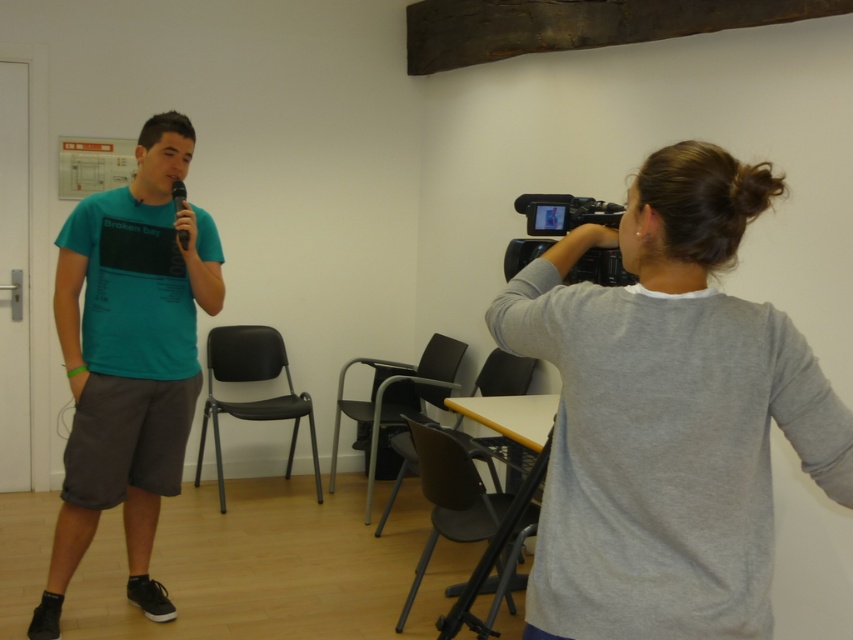
You are an assistant in the recording studio. You need to adjust the microphone so that it is positioned to the right of the gray matte shirt. Is the black matte microphone at left currently positioned to the right of the gray matte shirt at upper right?

The gray matte shirt at upper right is to the right of the black matte microphone at left, so the black matte microphone at left is not positioned to the right of the gray matte shirt at upper right. You need to move it to the right side of the gray matte shirt at upper right.

You are setting up a camera to film the scene. The camera is mounted on the black plastic tripod at lower center. To ensure the gray matte shirt at upper right is fully visible in the frame, should you adjust the camera angle upwards or downwards?

The gray matte shirt at upper right is above the black plastic tripod at lower center, so you should adjust the camera angle upwards to capture the gray matte shirt at upper right in the frame.

You are a photographer positioned in the room and want to capture a clear shot of both the gray matte shirt at upper right and the black plastic tripod at lower center. Which object should you focus on first to ensure both are in focus?

You should focus on the gray matte shirt at upper right first because it is closer to the viewer than the black plastic tripod at lower center. By focusing on the closer object, the tripod will still be within the depth of field and in focus.